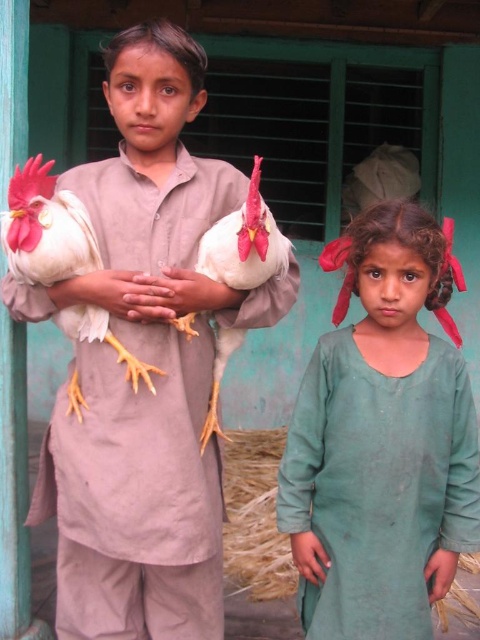
In the scene shown: You are a photographer trying to capture a photo of the green fabric dress at lower right and the white feathered chicken at left. Which object should you focus on first if you want to ensure both are in focus, considering their heights?

The green fabric dress at lower right is taller than the white feathered chicken at left, so you should focus on the taller object first to ensure both are in focus.